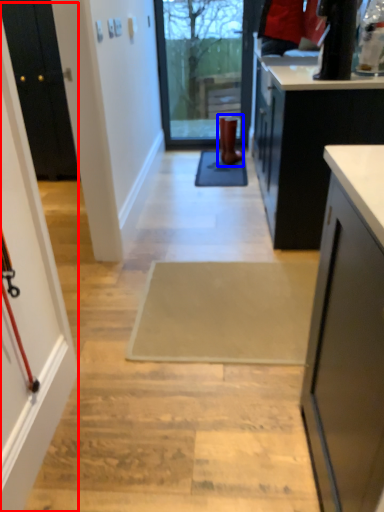
Question: Which object is closer to the camera taking this photo, screen door (highlighted by a red box) or footwear (highlighted by a blue box)?

Choices:
 (A) screen door
 (B) footwear

Answer: (A)